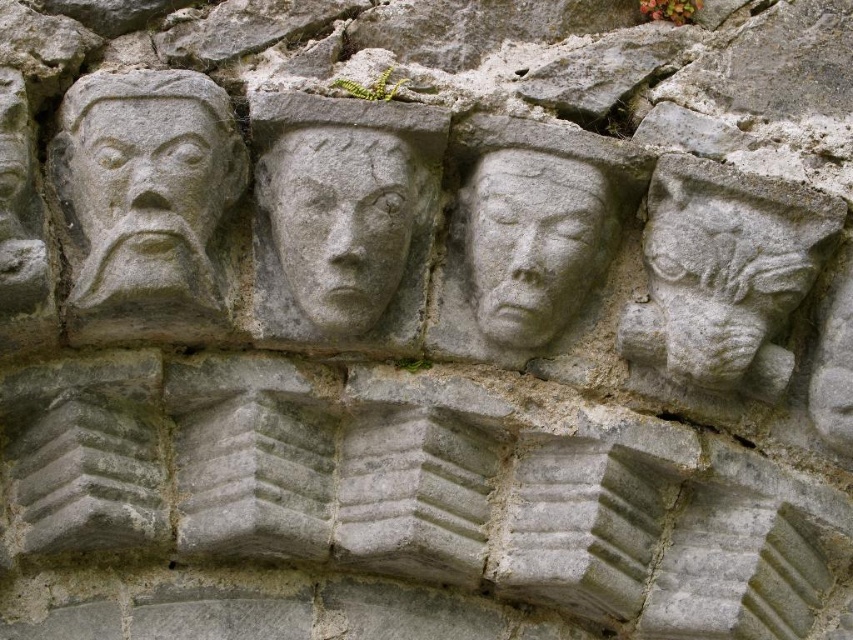
Is gray stone face at left below stone carved face at right?

No.

Who is more forward, (180, 144) or (715, 317)?

Point (180, 144)

Where is `gray stone face at left`? gray stone face at left is located at coordinates (144, 188).

Is gray stone face at left to the right of gray stone carving at center from the viewer's perspective?

In fact, gray stone face at left is to the left of gray stone carving at center.

Which is above, gray stone face at left or gray stone carving at center?

gray stone face at left is higher up.

Identify the location of gray stone face at left. The height and width of the screenshot is (640, 853). (144, 188).

How far apart are gray stone face at center and gray stone carving at center?

gray stone face at center and gray stone carving at center are 4.28 inches apart.

Which of these two, gray stone face at center or gray stone carving at center, stands taller?

gray stone face at center is taller.

You are a GUI agent. You are given a task and a screenshot of the screen. Output one action in this format:
    pyautogui.click(x=<x>, y=<y>)
    Task: Click on the gray stone face at center
    The image size is (853, 640).
    Given the screenshot: What is the action you would take?
    pyautogui.click(x=344, y=218)

Find the location of a particular element. gray stone face at center is located at coordinates (344, 218).